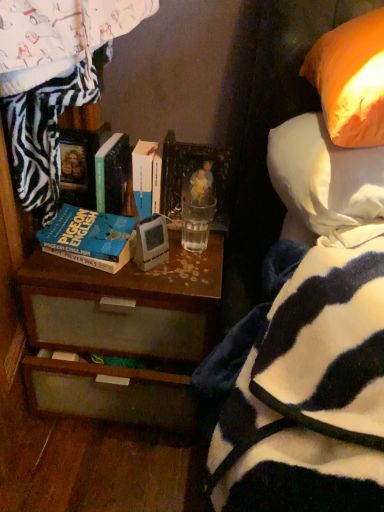
Question: From a real-world perspective, relative to hardcover book at center, the second book from the right, is matte plastic picture frame at upper center vertically above or below?

Choices:
 (A) below
 (B) above

Answer: (A)

Question: In terms of height, does matte plastic picture frame at upper center look taller or shorter compared to hardcover book at center, the second book from the right?

Choices:
 (A) short
 (B) tall

Answer: (A)

Question: Estimate the real-world distances between objects in this image. Which object is closer to the hardcover book at center, which is counted as the second book, starting from the left?

Choices:
 (A) blue matte book at center left, which appears as the 1th book when viewed from the left
 (B) brown wood desk at center
 (C) clear glass at center
 (D) matte plastic picture frame at upper center
 (E) orange fabric pillow at upper right

Answer: (A)

Question: Estimate the real-world distances between objects in this image. Which object is closer to the matte plastic picture frame at upper center?

Choices:
 (A) hardcover book at center, the second book from the right
 (B) white matte book at center, the first book when ordered from right to left
 (C) blue matte book at center left, the 3th book viewed from the right
 (D) orange fabric pillow at upper right
 (E) clear glass at center

Answer: (E)